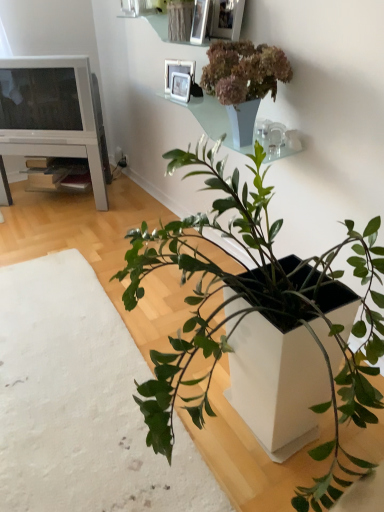
Question: From a real-world perspective, is white wood entertainment center at left positioned over white glossy picture frame at upper center, which is counted as the 4th picture frame, starting from the front, based on gravity?

Choices:
 (A) no
 (B) yes

Answer: (A)

Question: Is white wood entertainment center at left positioned behind white glossy picture frame at upper center, which is the 1th picture frame in back-to-front order?

Choices:
 (A) no
 (B) yes

Answer: (B)

Question: Is white wood entertainment center at left not near white glossy picture frame at upper center, which is the 1th picture frame in back-to-front order?

Choices:
 (A) no
 (B) yes

Answer: (A)

Question: Does white wood entertainment center at left have a smaller size compared to white glossy picture frame at upper center, which is counted as the 4th picture frame, starting from the front?

Choices:
 (A) yes
 (B) no

Answer: (B)

Question: Is white wood entertainment center at left oriented towards white glossy picture frame at upper center, which is counted as the 4th picture frame, starting from the front?

Choices:
 (A) yes
 (B) no

Answer: (B)

Question: Is point (195, 23) closer or farther from the camera than point (62, 61)?

Choices:
 (A) closer
 (B) farther

Answer: (A)

Question: In terms of width, does metallic silver picture frame at upper center, which appears as the second picture frame when viewed from the front, look wider or thinner when compared to matte white television at upper left?

Choices:
 (A) wide
 (B) thin

Answer: (B)

Question: Relative to matte white television at upper left, is metallic silver picture frame at upper center, which appears as the second picture frame when viewed from the front, in front or behind?

Choices:
 (A) front
 (B) behind

Answer: (A)

Question: In the image, is metallic silver picture frame at upper center, which appears as the second picture frame when viewed from the front, on the left side or the right side of matte white television at upper left?

Choices:
 (A) right
 (B) left

Answer: (A)

Question: From the image's perspective, relative to translucent glass shelf at upper center, is white glossy picture frame at upper center, which is the 1th picture frame in back-to-front order, above or below?

Choices:
 (A) above
 (B) below

Answer: (A)

Question: Do you think white glossy picture frame at upper center, which is the 1th picture frame in back-to-front order, is within translucent glass shelf at upper center, or outside of it?

Choices:
 (A) outside
 (B) inside

Answer: (A)

Question: Considering the relative positions of white glossy picture frame at upper center, which is counted as the 4th picture frame, starting from the front, and translucent glass shelf at upper center in the image provided, is white glossy picture frame at upper center, which is counted as the 4th picture frame, starting from the front, to the left or to the right of translucent glass shelf at upper center?

Choices:
 (A) left
 (B) right

Answer: (A)

Question: In the image, is white glossy picture frame at upper center, which is the 1th picture frame in back-to-front order, positioned in front of or behind translucent glass shelf at upper center?

Choices:
 (A) front
 (B) behind

Answer: (B)

Question: In terms of height, does green matte plant at center, acting as the 1th houseplant starting from the left, look taller or shorter compared to white wood entertainment center at left?

Choices:
 (A) tall
 (B) short

Answer: (B)

Question: Considering the positions of green matte plant at center, acting as the 1th houseplant starting from the left, and white wood entertainment center at left in the image, is green matte plant at center, acting as the 1th houseplant starting from the left, wider or thinner than white wood entertainment center at left?

Choices:
 (A) wide
 (B) thin

Answer: (A)